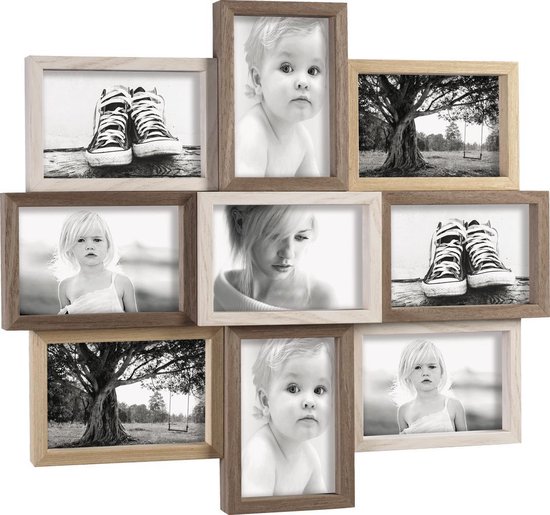
Locate an element on the screen. framed photos is located at coordinates pyautogui.click(x=145, y=144), pyautogui.click(x=123, y=278), pyautogui.click(x=124, y=373), pyautogui.click(x=268, y=387), pyautogui.click(x=296, y=270), pyautogui.click(x=287, y=139), pyautogui.click(x=403, y=134), pyautogui.click(x=448, y=259), pyautogui.click(x=414, y=384).